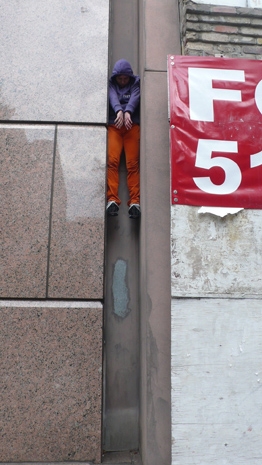
Where is `wall`? wall is located at coordinates tap(47, 253), tap(210, 279).